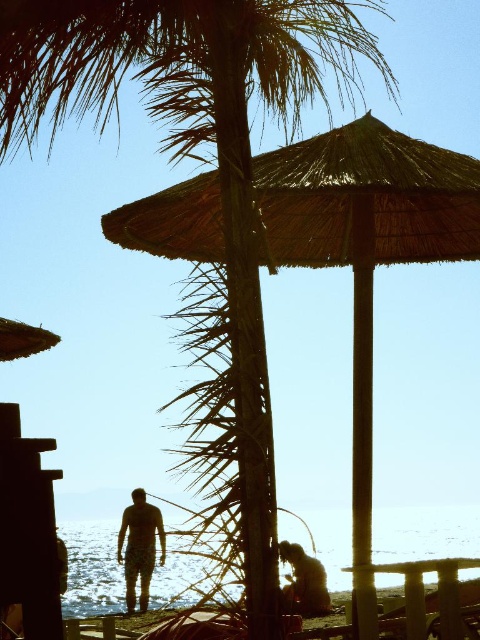
Is thatched straw umbrella at center bigger than camouflage pants at center?

Indeed, thatched straw umbrella at center has a larger size compared to camouflage pants at center.

Is point (410, 216) less distant than point (133, 576)?

Yes, it is in front of point (133, 576).

Does point (369, 250) lie behind point (137, 548)?

No, (369, 250) is closer to viewer.

In order to click on thatched straw umbrella at center in this screenshot , I will do `click(365, 248)`.

What do you see at coordinates (365, 248) in the screenshot? Image resolution: width=480 pixels, height=640 pixels. I see `thatched straw umbrella at center` at bounding box center [365, 248].

The width and height of the screenshot is (480, 640). Identify the location of thatched straw umbrella at center. (365, 248).

The width and height of the screenshot is (480, 640). I want to click on thatched straw umbrella at center, so click(x=365, y=248).

Is point (128, 531) behind point (304, 579)?

Yes, it is.

Describe the element at coordinates (140, 547) in the screenshot. The width and height of the screenshot is (480, 640). I see `camouflage pants at center` at that location.

At what (x,y) coordinates should I click in order to perform the action: click on camouflage pants at center. Please return your answer as a coordinate pair (x, y). Looking at the image, I should click on (140, 547).